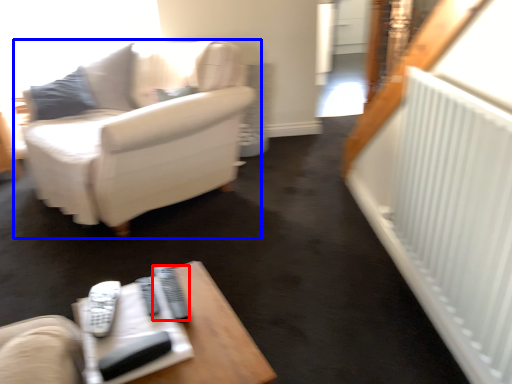
Question: Among these objects, which one is farthest to the camera, remote (highlighted by a red box) or studio couch (highlighted by a blue box)?

Choices:
 (A) remote
 (B) studio couch

Answer: (B)